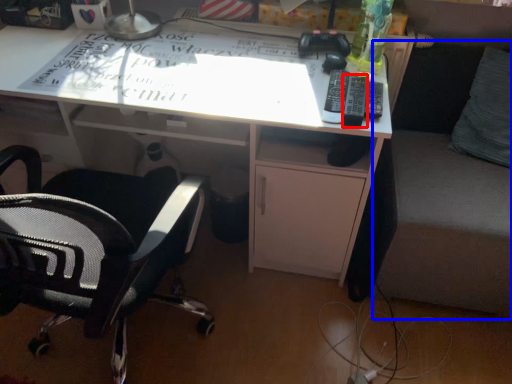
Question: Which point is further to the camera, remote (highlighted by a red box) or couch (highlighted by a blue box)?

Choices:
 (A) remote
 (B) couch

Answer: (A)